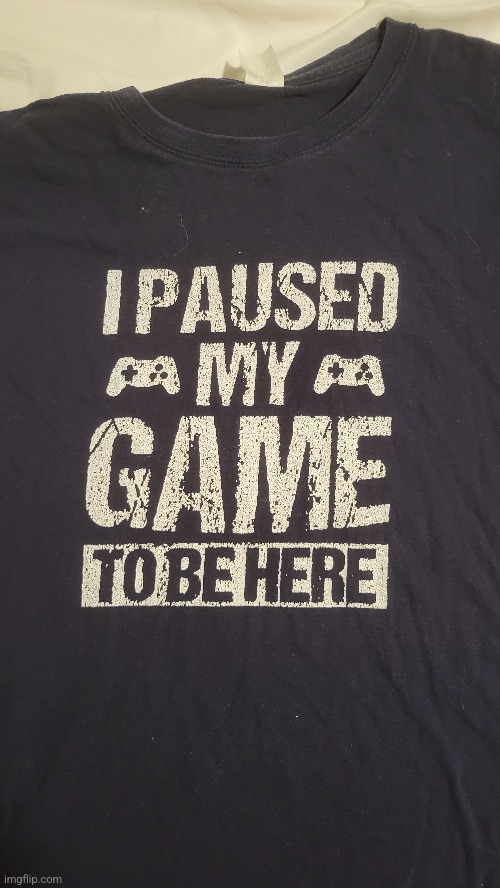
I want to click on white sheet, so click(171, 24).